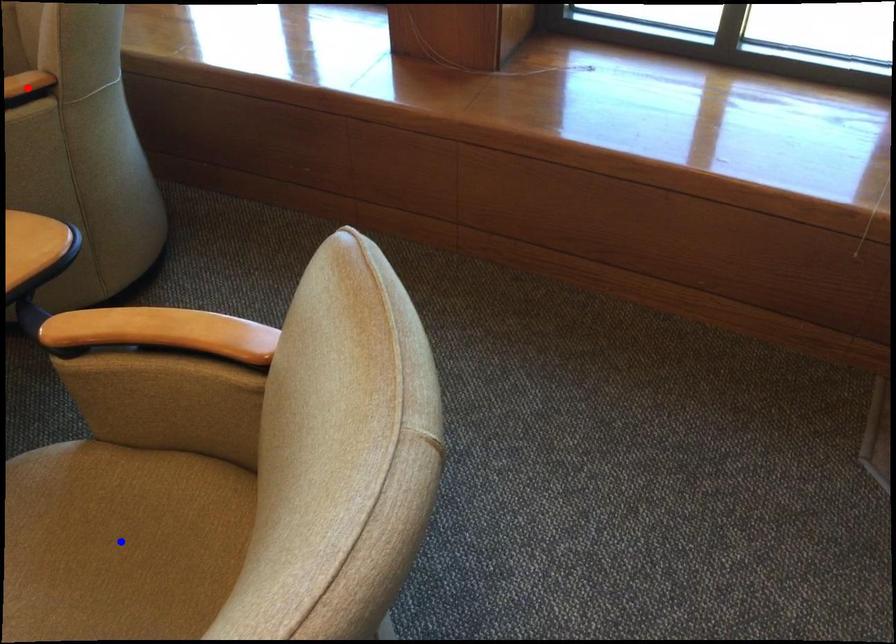
Question: Two points are marked on the image. Which point is closer to the camera?

Choices:
 (A) Blue point is closer.
 (B) Red point is closer.

Answer: (A)